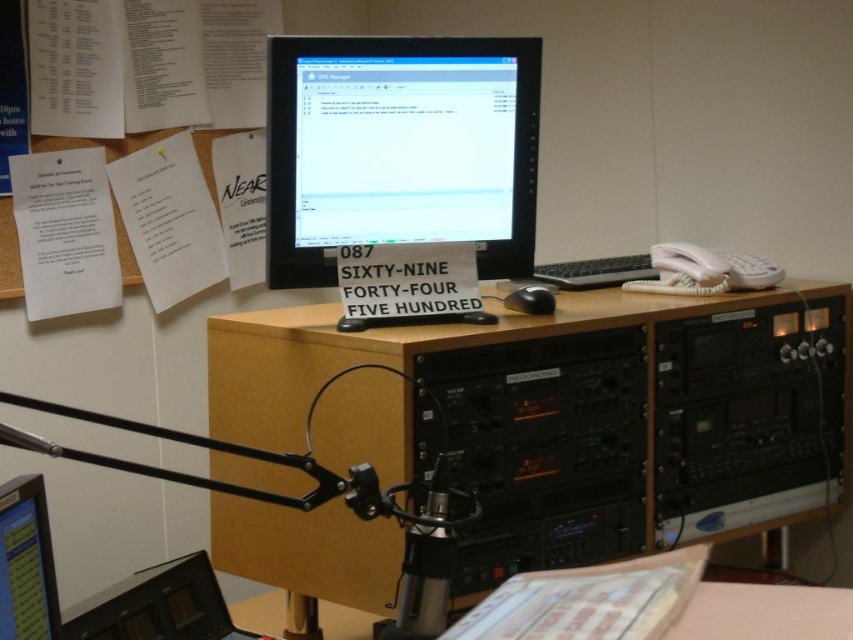
Does black plastic computer desk at center appear over matte black monitor at center?

Actually, black plastic computer desk at center is below matte black monitor at center.

Looking at this image, which of these two, black plastic computer desk at center or matte black monitor at center, stands taller?

black plastic computer desk at center is taller.

Find the location of `black plastic computer desk at center`. black plastic computer desk at center is located at coordinates (558, 406).

Identify the location of black plastic computer desk at center. Image resolution: width=853 pixels, height=640 pixels. (558, 406).

Is black plastic computer desk at center to the left of black matte keyboard at center from the viewer's perspective?

Yes, black plastic computer desk at center is to the left of black matte keyboard at center.

Who is positioned more to the left, black plastic computer desk at center or black matte keyboard at center?

Positioned to the left is black plastic computer desk at center.

Find the location of a particular element. black plastic computer desk at center is located at coordinates (558, 406).

Is point (396, 106) in front of point (622, 268)?

Yes, it is.

This screenshot has width=853, height=640. I want to click on matte black monitor at center, so click(x=399, y=148).

Measure the distance between matte black monitor at center and camera.

They are 4.05 feet apart.

I want to click on matte black monitor at center, so click(399, 148).